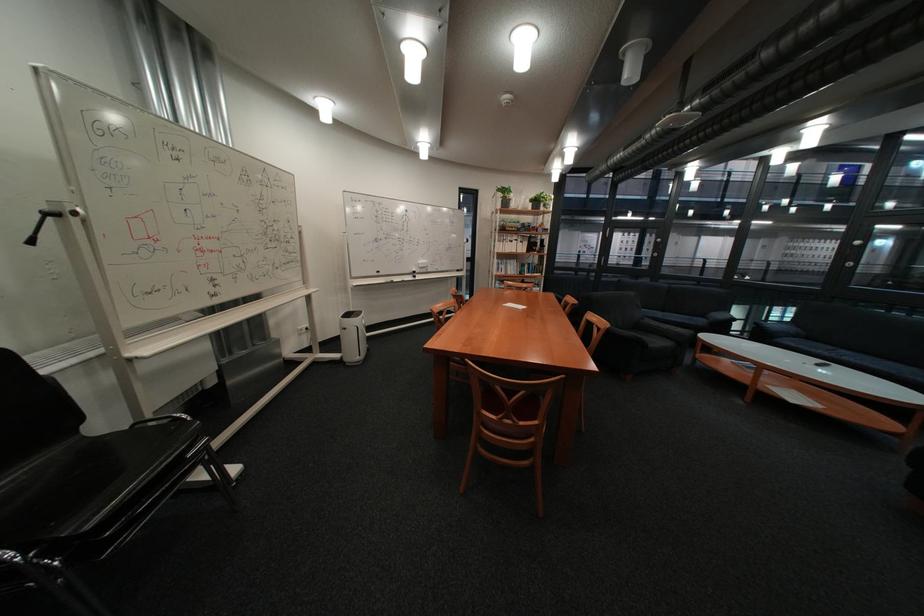
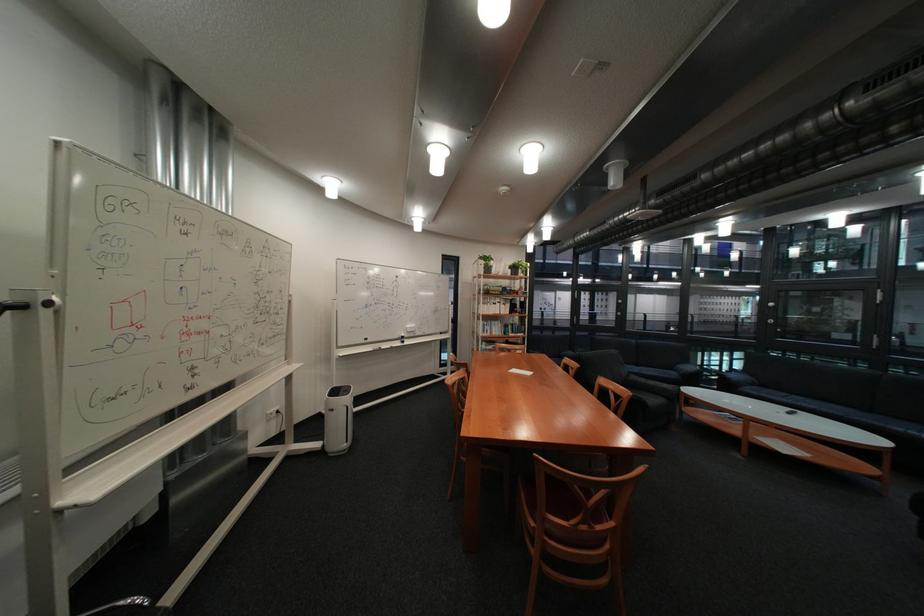
Question: What movement of the cameraman would produce the second image?

Choices:
 (A) Left
 (B) Right
 (C) Forward
 (D) Backward

Answer: (A)